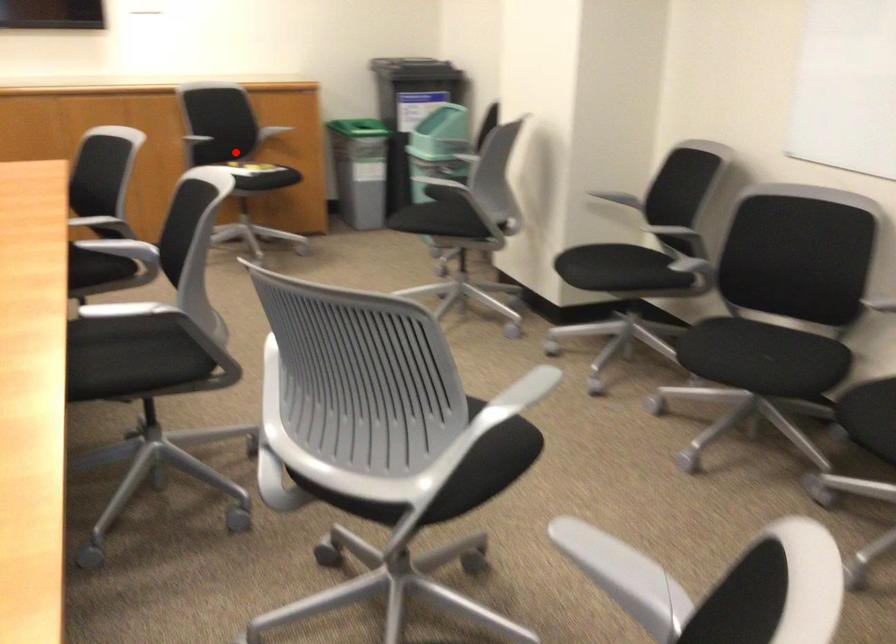
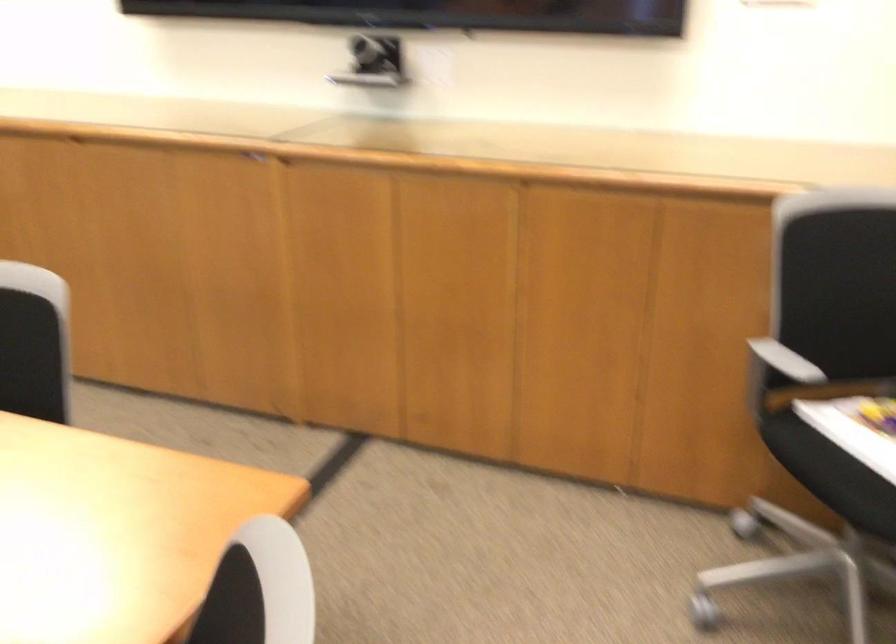
Question: I am providing you with two images of the same scene from different viewpoints. A red point is marked on the first image. Is the red point's position out of view in image 2?

Choices:
 (A) Yes
 (B) No

Answer: (B)